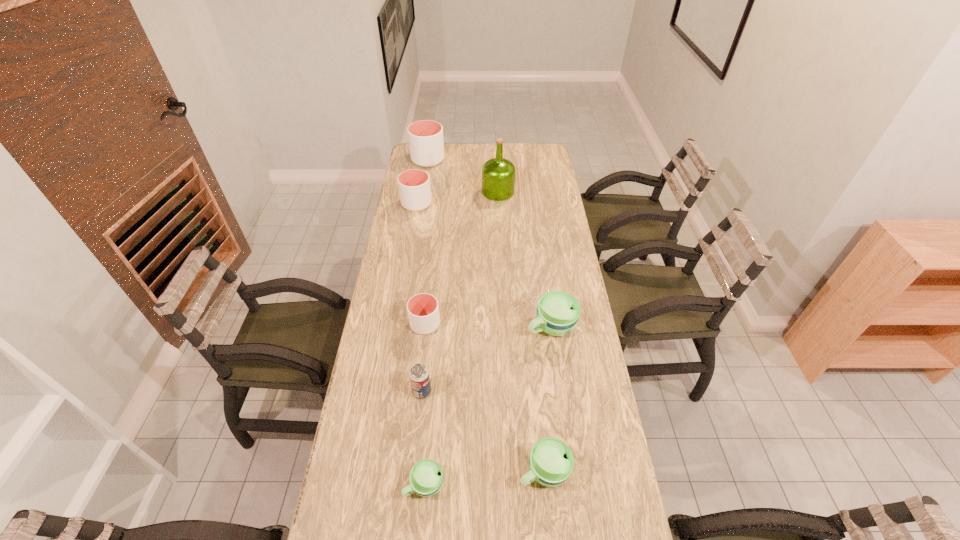
Locate which cup is the second closest to the green olive oil. Please provide its 2D coordinates. Your answer should be formatted as a tuple, i.e. [(x, y)], where the tuple contains the x and y coordinates of a point satisfying the conditions above.

[(414, 185)]

Identify which white cup is the third nearest to the biggest blue cup. Please provide its 2D coordinates. Your answer should be formatted as a tuple, i.e. [(x, y)], where the tuple contains the x and y coordinates of a point satisfying the conditions above.

[(426, 144)]

Point out which white cup is positioned as the second nearest to the smallest white cup. Please provide its 2D coordinates. Your answer should be formatted as a tuple, i.e. [(x, y)], where the tuple contains the x and y coordinates of a point satisfying the conditions above.

[(426, 144)]

Identify which blue cup is located as the third nearest to the third nearest object. Please provide its 2D coordinates. Your answer should be formatted as a tuple, i.e. [(x, y)], where the tuple contains the x and y coordinates of a point satisfying the conditions above.

[(558, 312)]

Locate which blue cup ranks in proximity to the sixth shortest object. Please provide its 2D coordinates. Your answer should be formatted as a tuple, i.e. [(x, y)], where the tuple contains the x and y coordinates of a point satisfying the conditions above.

[(558, 312)]

The width and height of the screenshot is (960, 540). In order to click on blank space that satisfies the following two spatial constraints: 1. on the front side of the second biggest blue cup; 2. on the right side of the nearest white cup in this screenshot , I will do `click(409, 471)`.